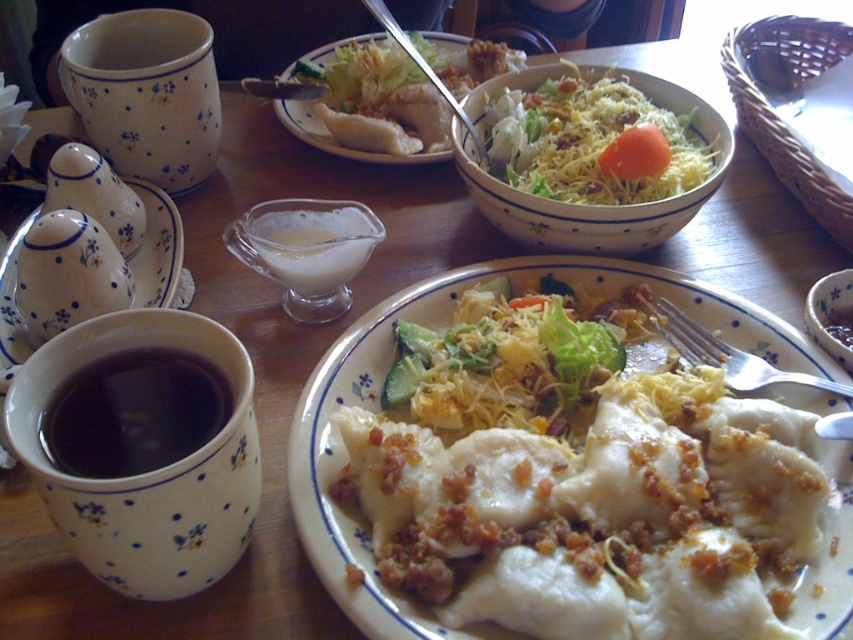
From the picture: You are a guest at this table and want to reach for the white ceramic sugar bowl at left. Which direction should you move your hand from the white matte plate at center to get it?

You should move your hand to the left from the white matte plate at center to reach the white ceramic sugar bowl at left since the white matte plate at center is to the right of the white ceramic sugar bowl at left.

You are a guest at this table and want to eat both the white dumplings at center and the orange smooth carrot at center. Which one should you pick up first if you want to eat the larger portion?

The white dumplings at center is bigger than the orange smooth carrot at center, so you should pick up the white dumplings at center first to eat the larger portion.